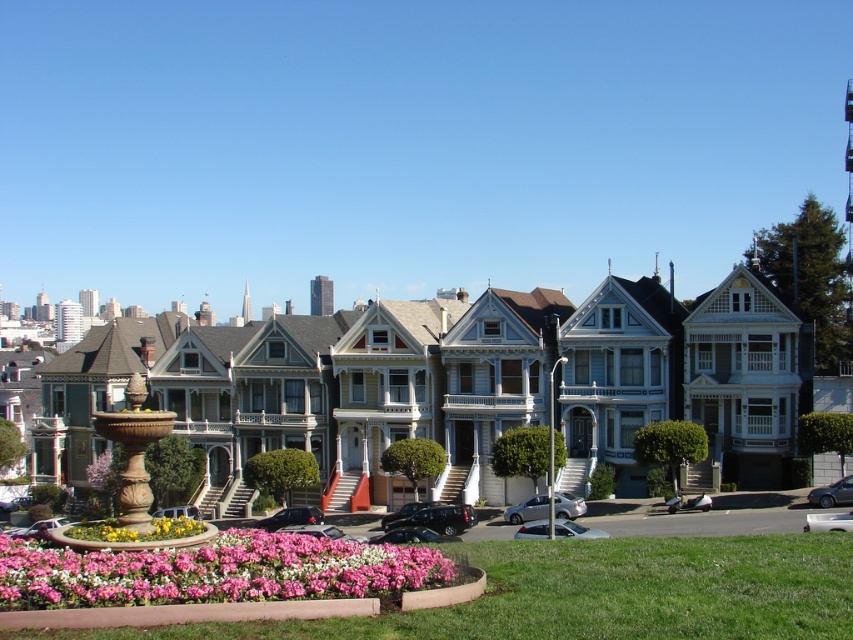
You are a landscape architect designing a new garden layout. You need to place a new statue that requires a base at least 1 meter tall. Given the scene, which object between the marble fountain at center left and the floral mosaic at center would be suitable for placing the statue?

The marble fountain at center left is taller than the floral mosaic at center, so the statue can be placed on the marble fountain at center left since it meets the height requirement.

You are a gardener planning to water the pink floral bed at lower center and the marble fountain at center left. Which object should you water first if you start from the path at the bottom of the image?

The pink floral bed at lower center should be watered first because it is located below the marble fountain at center left, making it closer to the starting point at the bottom path.